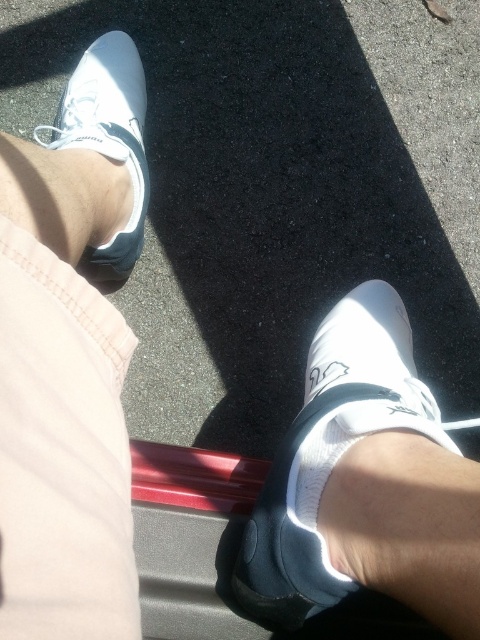
Question: Can you confirm if white matte shoe at lower center is smaller than white matte shoe at upper left?

Choices:
 (A) no
 (B) yes

Answer: (A)

Question: Where is white matte shoe at lower center located in relation to white matte shoe at upper left in the image?

Choices:
 (A) right
 (B) left

Answer: (A)

Question: Which point is farther to the camera?

Choices:
 (A) white matte shoe at upper left
 (B) white matte shoe at lower center

Answer: (A)

Question: Is white matte shoe at lower center above white matte shoe at upper left?

Choices:
 (A) no
 (B) yes

Answer: (A)

Question: Which point is closer to the camera?

Choices:
 (A) white matte shoe at upper left
 (B) white matte shoe at lower center

Answer: (B)